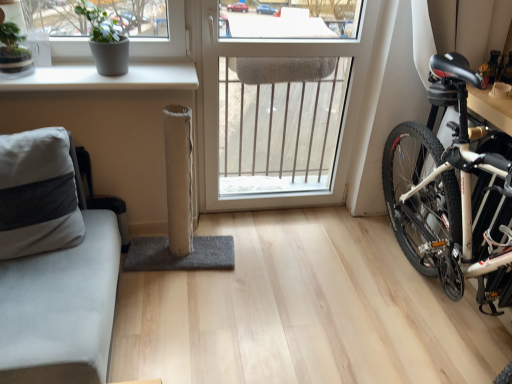
Where is `free spot below gray matte pot at upper left (from a real-world perspective)`? This screenshot has height=384, width=512. free spot below gray matte pot at upper left (from a real-world perspective) is located at coordinates (108, 76).